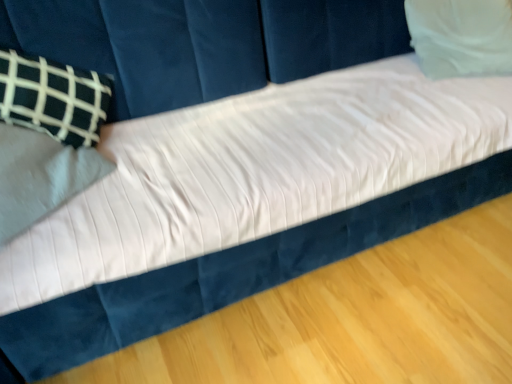
Question: Should I look upward or downward to see white soft pillow at upper right?

Choices:
 (A) down
 (B) up

Answer: (B)